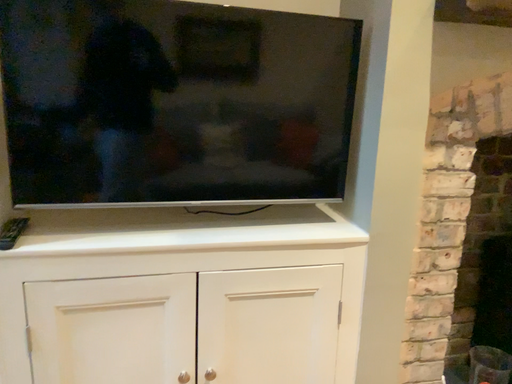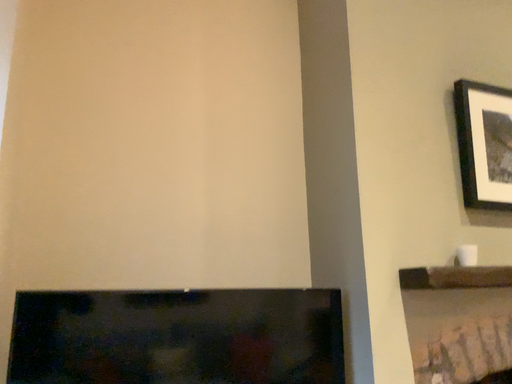
Question: Which way did the camera rotate in the video?

Choices:
 (A) rotated right
 (B) rotated left

Answer: (A)